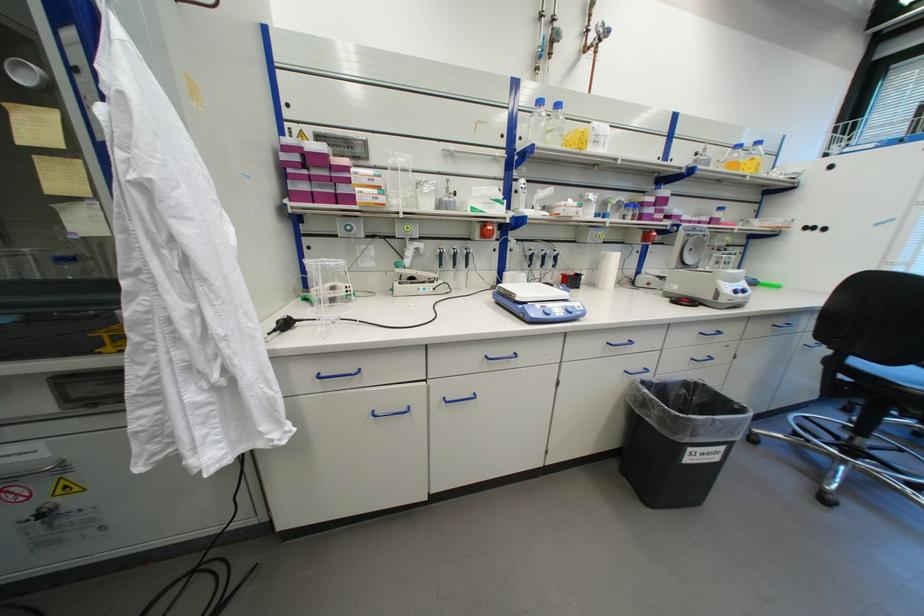
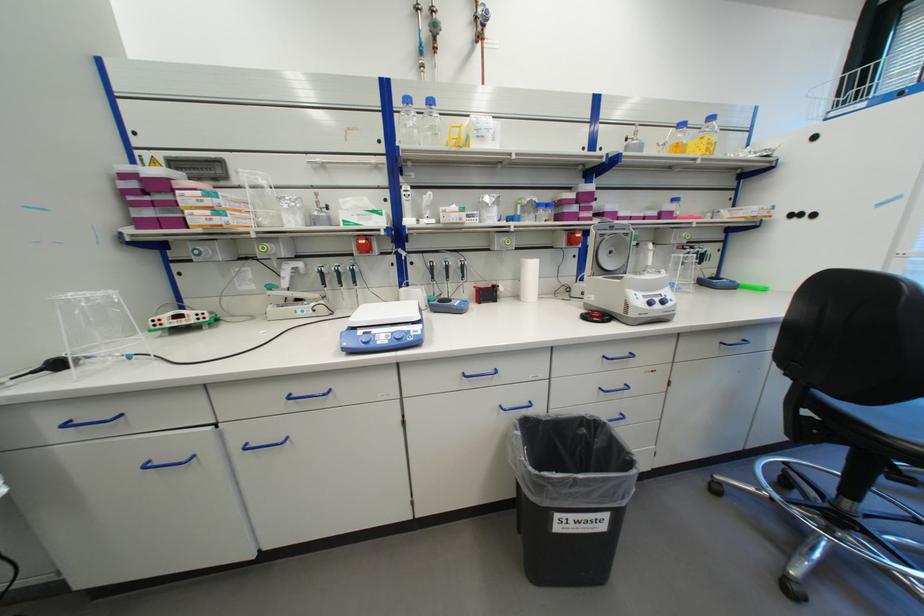
Where in the second image is the point corresponding to [578,315] from the first image?

(405, 344)